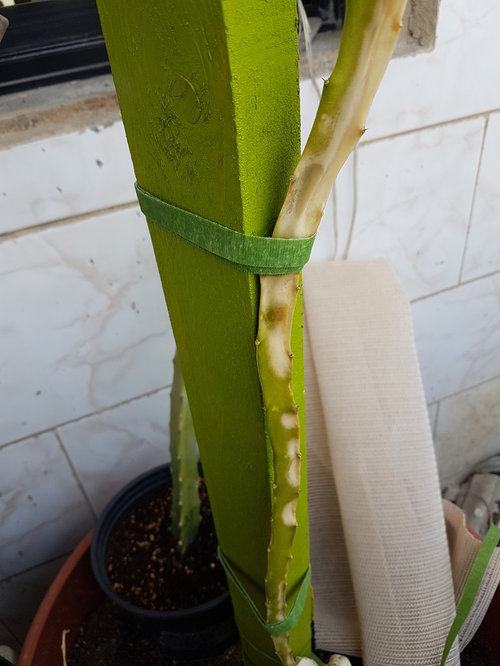
At what (x,y) coordinates should I click in order to perform the action: click on 2 areas of dirt in flower pots. Please return your answer as a coordinate pair (x, y). The width and height of the screenshot is (500, 666). Looking at the image, I should click on (148, 575), (115, 649).